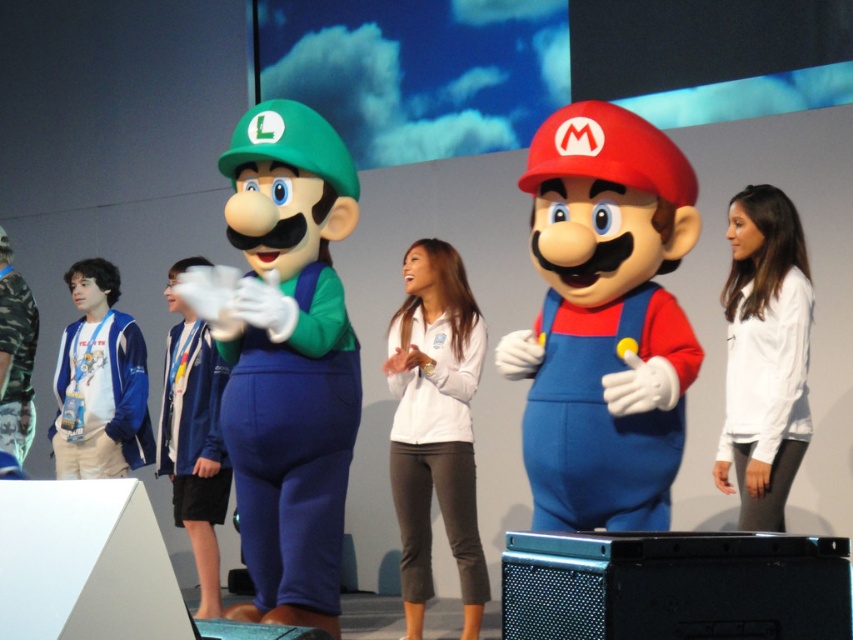
Question: Can you confirm if matte plastic mario at center is positioned above white matte jacket at center?

Choices:
 (A) no
 (B) yes

Answer: (B)

Question: Which point appears closest to the camera in this image?

Choices:
 (A) (328, 374)
 (B) (793, 465)

Answer: (A)

Question: Which point is farther from the camera taking this photo?

Choices:
 (A) click(x=788, y=284)
 (B) click(x=85, y=404)
 (C) click(x=4, y=332)

Answer: (B)

Question: Among these points, which one is farthest from the camera?

Choices:
 (A) (318, 365)
 (B) (670, 364)
 (C) (764, 257)
 (D) (463, 596)

Answer: (D)

Question: Does blue fleece jacket at center appear on the right side of camo fabric shirt at left?

Choices:
 (A) yes
 (B) no

Answer: (A)

Question: Can you confirm if matte plastic mario at center is smaller than camo fabric shirt at left?

Choices:
 (A) yes
 (B) no

Answer: (B)